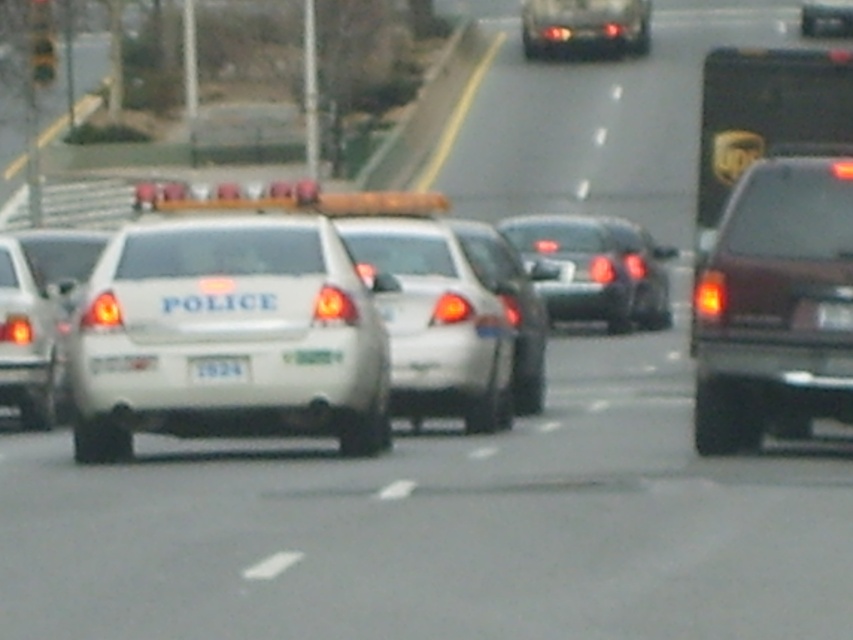
Question: Is dark red plastic suv at right positioned at the back of white plastic license plate at center?

Choices:
 (A) no
 (B) yes

Answer: (A)

Question: Which point is closer to the camera?

Choices:
 (A) (636, 12)
 (B) (42, 12)
 (C) (726, 420)
 (D) (189, 364)

Answer: (D)

Question: Which point appears farthest from the camera in this image?

Choices:
 (A) tap(552, 48)
 (B) tap(640, 264)
 (C) tap(230, 364)
 (D) tap(751, 408)

Answer: (A)

Question: Among these points, which one is nearest to the camera?

Choices:
 (A) (624, 20)
 (B) (51, 45)
 (C) (656, 259)

Answer: (C)

Question: Is glossy black sedan at center thinner than white plastic license plate at center?

Choices:
 (A) yes
 (B) no

Answer: (A)

Question: Does glossy black sedan at center have a lesser width compared to shiny silver sedan at upper center?

Choices:
 (A) no
 (B) yes

Answer: (B)